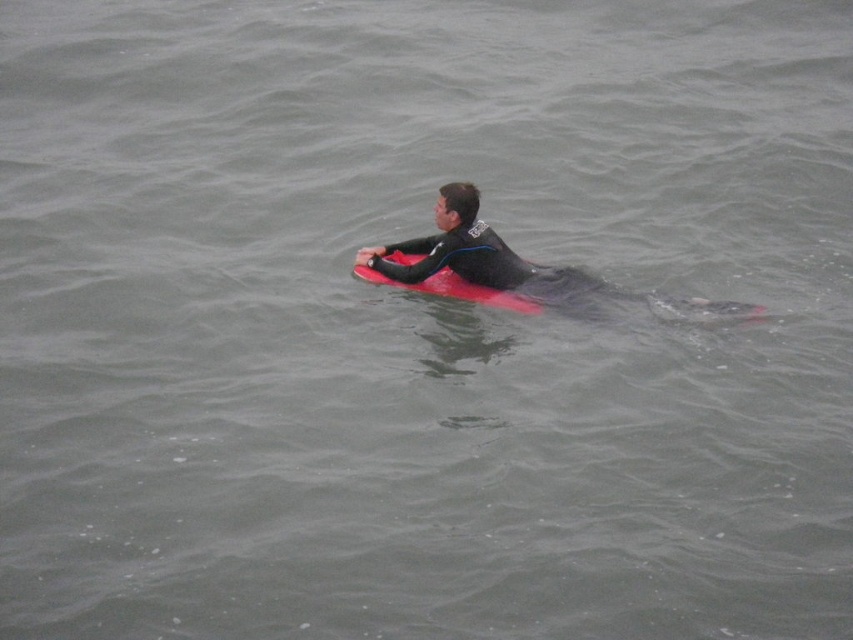
Does matte black wetsuit at center have a greater height compared to rubber matte surfboard at center?

Indeed, matte black wetsuit at center has a greater height compared to rubber matte surfboard at center.

Is matte black wetsuit at center further to the viewer compared to rubber matte surfboard at center?

That is False.

Does point (494, 280) come in front of point (502, 304)?

No, it is not.

I want to click on matte black wetsuit at center, so click(480, 260).